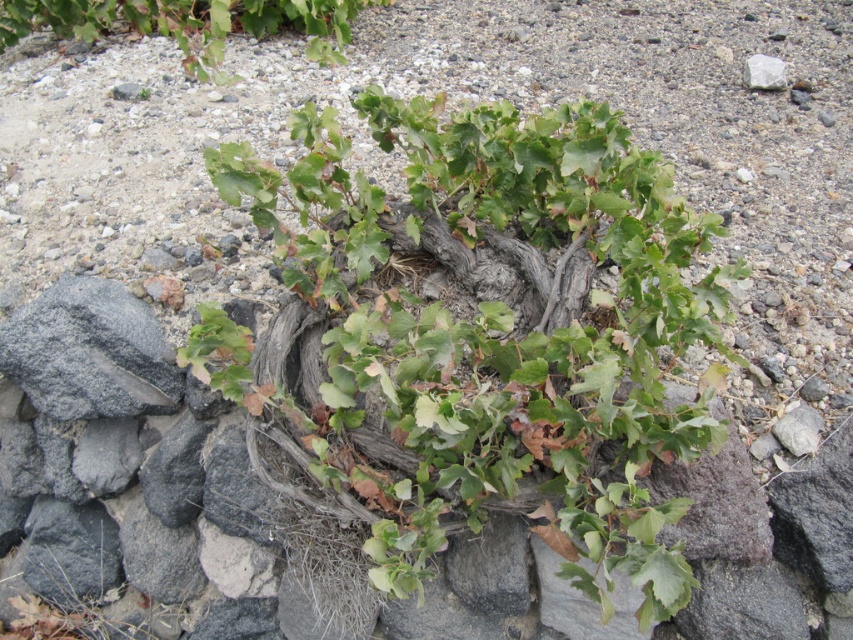
Question: Which of the following is the closest to the observer?

Choices:
 (A) white smooth rock at upper right
 (B) green leafy plant at upper center
 (C) green leafy plant at center

Answer: (C)

Question: Is green leafy plant at center to the right of white smooth rock at upper right from the viewer's perspective?

Choices:
 (A) yes
 (B) no

Answer: (B)

Question: Can you confirm if green leafy plant at upper center is thinner than white smooth rock at upper right?

Choices:
 (A) yes
 (B) no

Answer: (B)

Question: Which point is farther to the camera?

Choices:
 (A) green leafy plant at upper center
 (B) green leafy plant at center
 (C) white smooth rock at upper right

Answer: (A)

Question: Is green leafy plant at upper center in front of white smooth rock at upper right?

Choices:
 (A) yes
 (B) no

Answer: (B)

Question: Which of these objects is positioned farthest from the green leafy plant at upper center?

Choices:
 (A) white smooth rock at upper right
 (B) green leafy plant at center

Answer: (A)